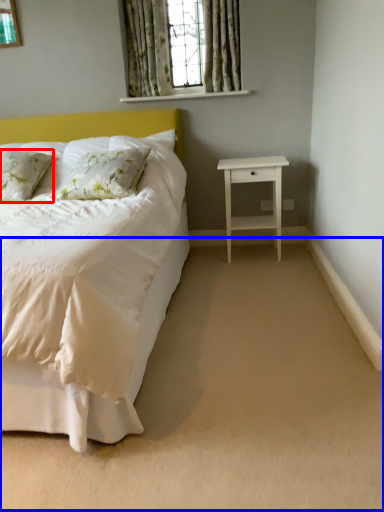
Question: Which of the following is the closest to the observer, pillow (highlighted by a red box) or plain (highlighted by a blue box)?

Choices:
 (A) pillow
 (B) plain

Answer: (B)